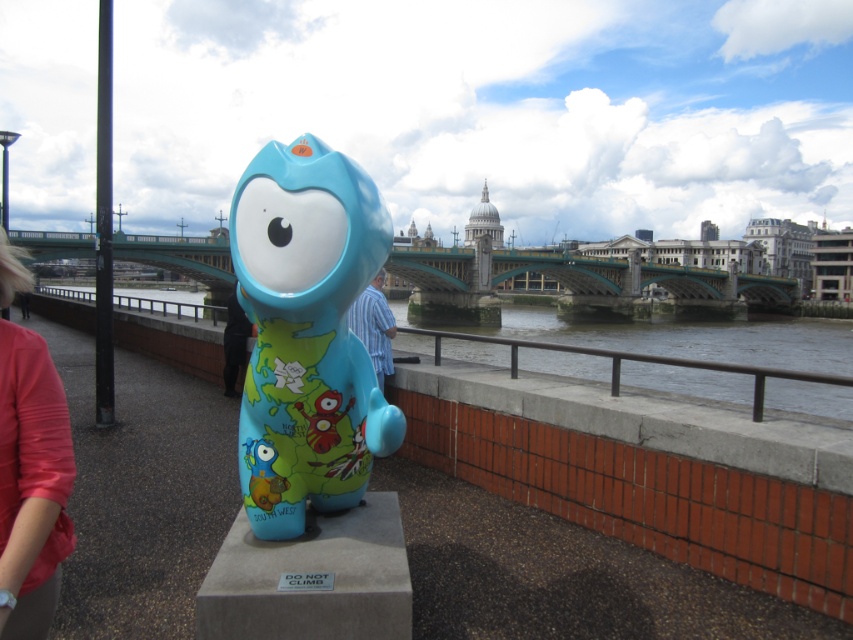
Is pink satin blouse at lower left to the right of matte blue statue at center from the viewer's perspective?

Yes, pink satin blouse at lower left is to the right of matte blue statue at center.

Is pink satin blouse at lower left further to the viewer compared to matte blue statue at center?

No, it is not.

What do you see at coordinates (32, 483) in the screenshot? The height and width of the screenshot is (640, 853). I see `pink satin blouse at lower left` at bounding box center [32, 483].

You are a GUI agent. You are given a task and a screenshot of the screen. Output one action in this format:
    pyautogui.click(x=<x>, y=<y>)
    Task: Click on the pink satin blouse at lower left
    This screenshot has height=640, width=853.
    Given the screenshot: What is the action you would take?
    pyautogui.click(x=32, y=483)

Is pink satin blouse at lower left to the left of blue striped shirt at center from the viewer's perspective?

Correct, you'll find pink satin blouse at lower left to the left of blue striped shirt at center.

Is pink satin blouse at lower left further to the viewer compared to blue striped shirt at center?

That is False.

This screenshot has height=640, width=853. Identify the location of pink satin blouse at lower left. (32, 483).

Does matte plastic sculpture at center have a greater width compared to matte blue statue at center?

In fact, matte plastic sculpture at center might be narrower than matte blue statue at center.

Consider the image. Who is higher up, matte plastic sculpture at center or matte blue statue at center?

Positioned higher is matte plastic sculpture at center.

Does point (299, 368) come in front of point (227, 344)?

Yes, point (299, 368) is closer to viewer.

This screenshot has width=853, height=640. Find the location of `matte plastic sculpture at center`. matte plastic sculpture at center is located at coordinates (306, 333).